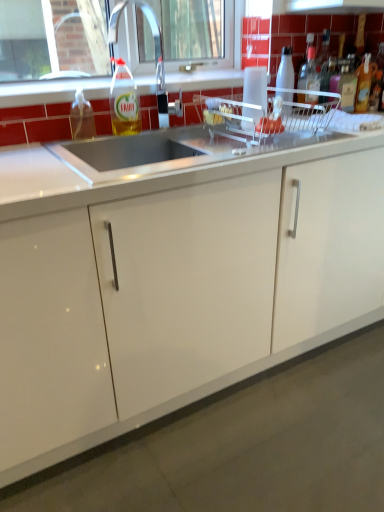
Locate an element on the screen. The image size is (384, 512). vacant area that is situated to the right of translucent plastic soap dispenser at sink left, which appears as the 1th bottle when viewed from the left is located at coordinates 120,143.